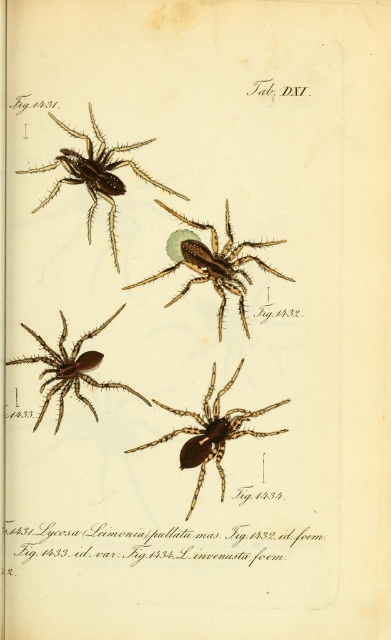
Does brown textured spider at center have a smaller size compared to shiny brown spider at center?

Yes.

You are a GUI agent. You are given a task and a screenshot of the screen. Output one action in this format:
    pyautogui.click(x=<x>, y=<y>)
    Task: Click on the brown textured spider at center
    This screenshot has width=391, height=640.
    Given the screenshot: What is the action you would take?
    pyautogui.click(x=213, y=262)

Is point (193, 257) less distant than point (220, 436)?

No, it is behind (220, 436).

In order to click on brown textured spider at center in this screenshot , I will do `click(213, 262)`.

Who is higher up, brown textured spider at upper left or shiny brown spider at center?

brown textured spider at upper left is higher up.

Between point (93, 195) and point (190, 442), which one is positioned in front?

Point (93, 195) is in front.

Does point (148, 138) come in front of point (200, 458)?

Yes, it is in front of point (200, 458).

The height and width of the screenshot is (640, 391). Identify the location of brown textured spider at upper left. (96, 173).

Between brown textured spider at center and brown textured spider at upper left, which one appears on the right side from the viewer's perspective?

brown textured spider at center is more to the right.

Between point (224, 228) and point (69, 132), which one is positioned behind?

Point (224, 228)

Where is `brown textured spider at center`? brown textured spider at center is located at coordinates (213, 262).